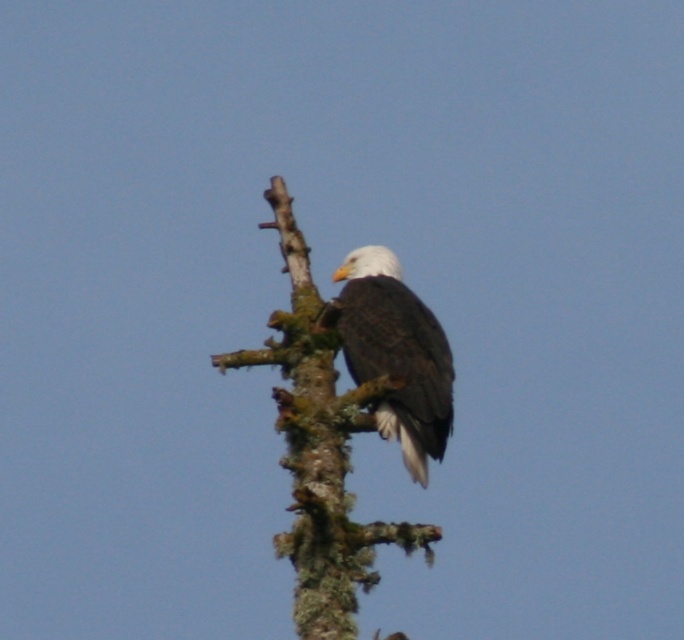
Can you confirm if green mossy branch at upper center is positioned to the right of white-feathered bald eagle at center?

No, green mossy branch at upper center is not to the right of white-feathered bald eagle at center.

Is green mossy branch at upper center taller than white-feathered bald eagle at center?

Incorrect, green mossy branch at upper center's height is not larger of white-feathered bald eagle at center's.

Find the location of a particular element. green mossy branch at upper center is located at coordinates (319, 449).